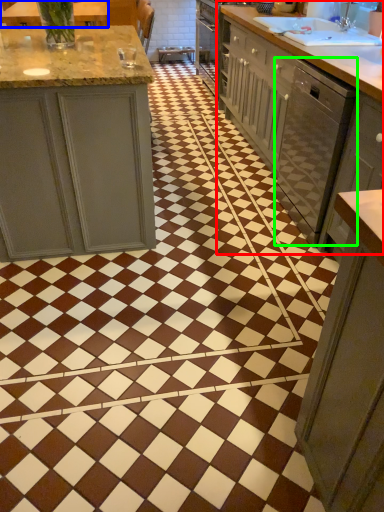
Question: Which object is positioned closest to countertop (highlighted by a red box)? Select from countertop (highlighted by a blue box) and dish washer (highlighted by a green box).

Choices:
 (A) countertop
 (B) dish washer

Answer: (B)